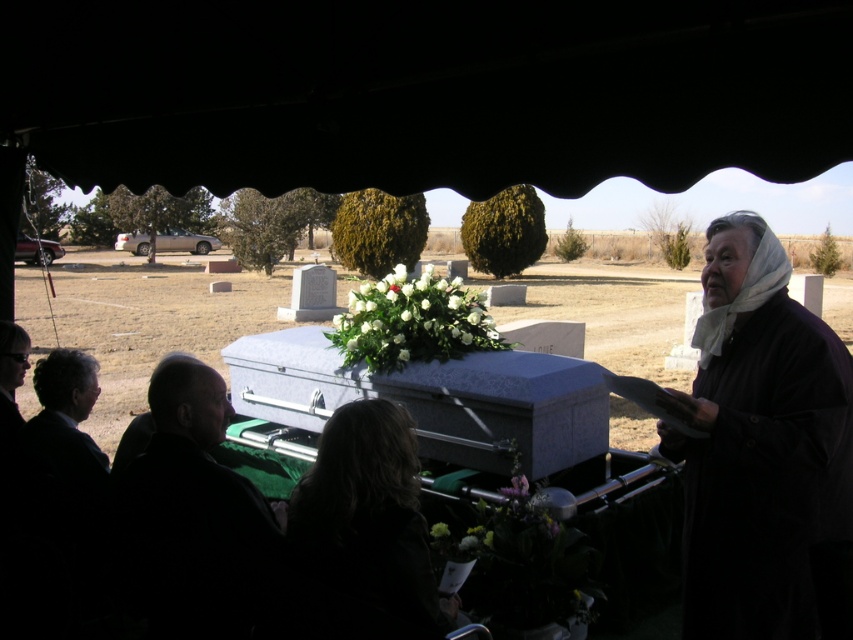
You are attending a funeral and need to find the dark gray suit at lower left. Based on the coordinates provided, where should you look relative to the casket?

The dark gray suit at lower left is located at coordinates approximately 0.806 on the x axis and 0.227 on the y axis relative to the casket.

You are attending a funeral and see the dark brown hair at lower center and the green matte flower at center. Which object is located to the left of the other?

The dark brown hair at lower center is positioned on the left side of green matte flower at center.